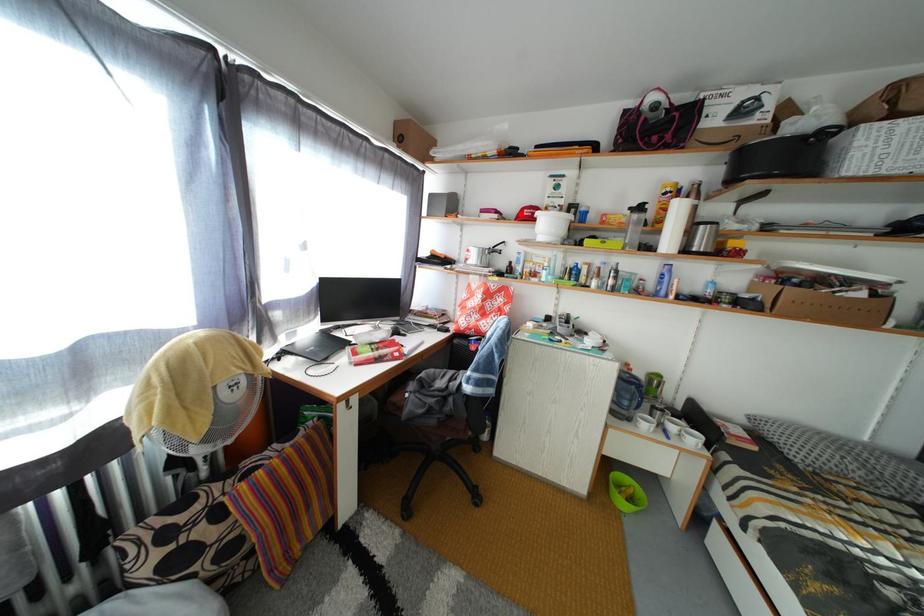
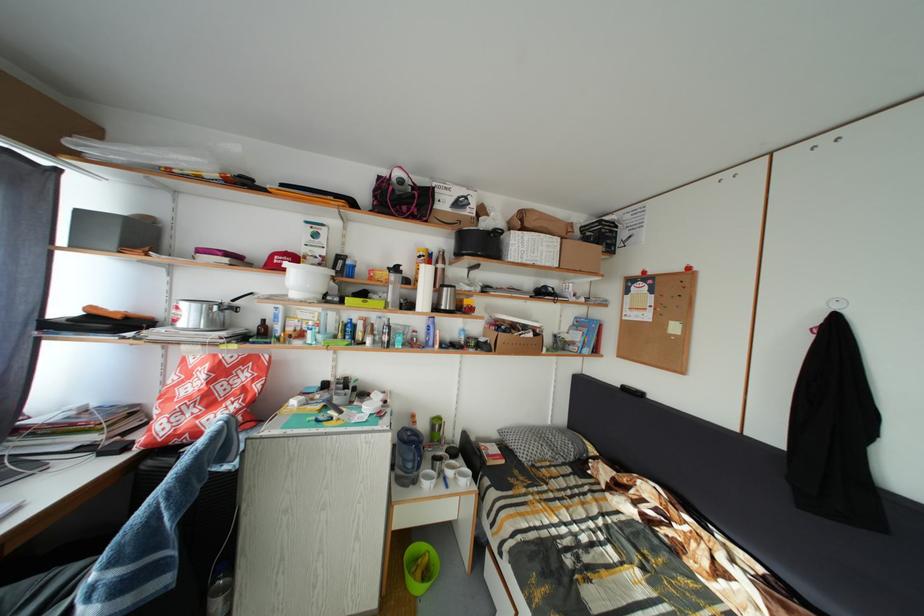
Locate, in the second image, the point that corresponds to the highlighted location in the first image.

(265, 257)